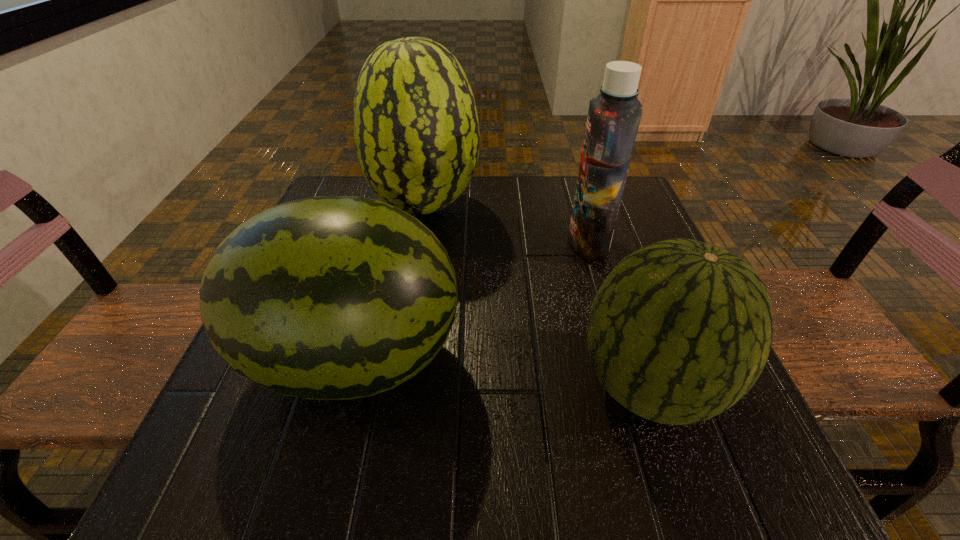
Where is `free space that is in between the farthest watermelon and the rightmost watermelon`? free space that is in between the farthest watermelon and the rightmost watermelon is located at coordinates (537, 296).

You are a GUI agent. You are given a task and a screenshot of the screen. Output one action in this format:
    pyautogui.click(x=<x>, y=<y>)
    Task: Click on the vacant space that's between the shampoo and the tallest watermelon
    
    Given the screenshot: What is the action you would take?
    pyautogui.click(x=507, y=224)

The width and height of the screenshot is (960, 540). In order to click on vacant space in between the rightmost watermelon and the farthest watermelon in this screenshot , I will do `click(537, 296)`.

The width and height of the screenshot is (960, 540). Identify the location of free space that is in between the rightmost watermelon and the farthest watermelon. (537, 296).

Where is `the closest object to the rightmost watermelon`? This screenshot has width=960, height=540. the closest object to the rightmost watermelon is located at coordinates (613, 120).

Identify which object is located as the nearest to the tallest watermelon. Please provide its 2D coordinates. Your answer should be formatted as a tuple, i.e. [(x, y)], where the tuple contains the x and y coordinates of a point satisfying the conditions above.

[(330, 297)]

The image size is (960, 540). Identify the location of watermelon that is the third closest to the shampoo. click(x=330, y=297).

Locate which watermelon ranks in proximity to the rightmost watermelon. Please provide its 2D coordinates. Your answer should be formatted as a tuple, i.e. [(x, y)], where the tuple contains the x and y coordinates of a point satisfying the conditions above.

[(330, 297)]

The height and width of the screenshot is (540, 960). Identify the location of blank area in the image that satisfies the following two spatial constraints: 1. on the front label of the rightmost watermelon; 2. on the left side of the shampoo. (632, 386).

The width and height of the screenshot is (960, 540). In order to click on blank space that satisfies the following two spatial constraints: 1. on the back side of the rightmost watermelon; 2. on the front label of the shampoo in this screenshot , I will do `click(601, 241)`.